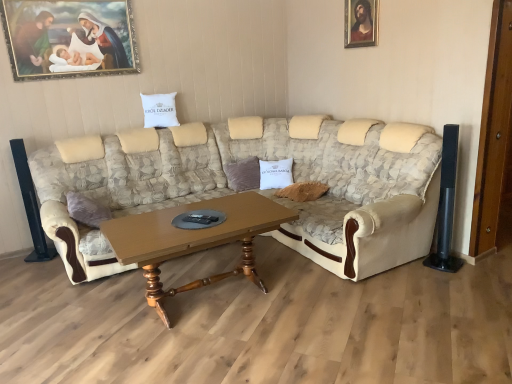
Where is `free spot to the right of brown wooden coffee table at center`? This screenshot has width=512, height=384. free spot to the right of brown wooden coffee table at center is located at coordinates (332, 310).